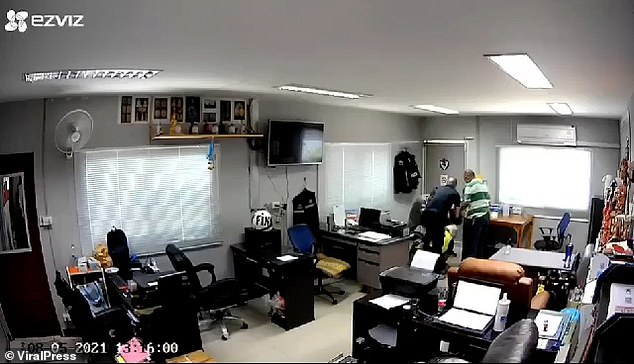
Where is `laptop`? laptop is located at coordinates (463, 312).